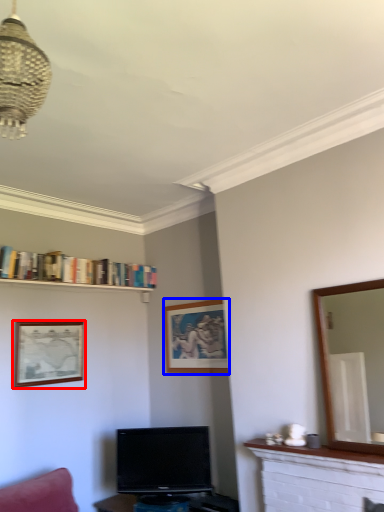
Question: Among these objects, which one is nearest to the camera, picture frame (highlighted by a red box) or picture frame (highlighted by a blue box)?

Choices:
 (A) picture frame
 (B) picture frame

Answer: (A)